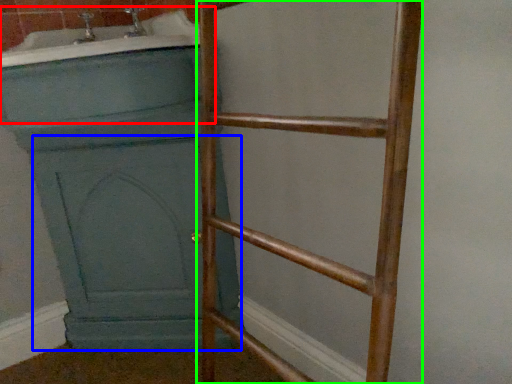
Question: Estimate the real-world distances between objects in this image. Which object is farther from bath (highlighted by a red box), screen door (highlighted by a blue box) or ladder (highlighted by a green box)?

Choices:
 (A) screen door
 (B) ladder

Answer: (A)